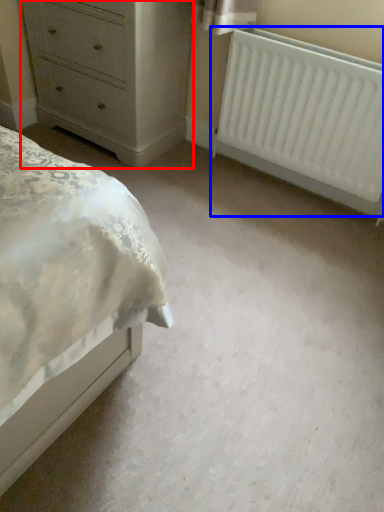
Question: Which object is further to the camera taking this photo, chest of drawers (highlighted by a red box) or radiator (highlighted by a blue box)?

Choices:
 (A) chest of drawers
 (B) radiator

Answer: (A)